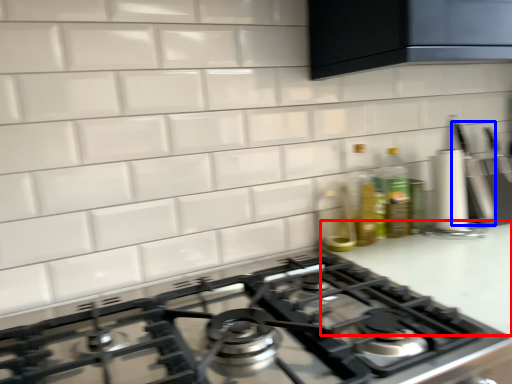
Question: Among these objects, which one is nearest to the camera, counter top (highlighted by a red box) or kitchen appliance (highlighted by a blue box)?

Choices:
 (A) counter top
 (B) kitchen appliance

Answer: (A)